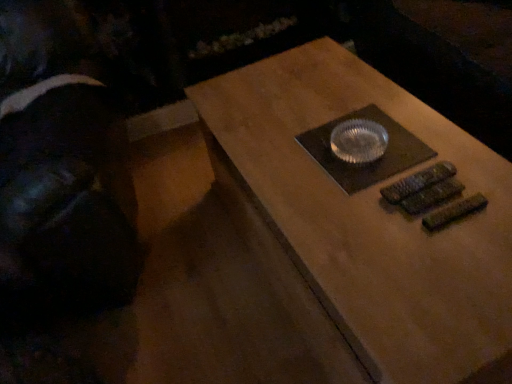
Question: From the image's perspective, is matte brown table at center located above or below black fabric at left?

Choices:
 (A) above
 (B) below

Answer: (B)

Question: Based on their positions, is matte brown table at center located to the left or right of black fabric at left?

Choices:
 (A) right
 (B) left

Answer: (A)

Question: From a real-world perspective, is matte brown table at center above or below black fabric at left?

Choices:
 (A) above
 (B) below

Answer: (B)

Question: From a real-world perspective, is black fabric at left positioned above or below matte brown table at center?

Choices:
 (A) below
 (B) above

Answer: (B)

Question: Does point (38, 221) appear closer or farther from the camera than point (266, 152)?

Choices:
 (A) closer
 (B) farther

Answer: (A)

Question: Is black fabric at left inside the boundaries of matte brown table at center, or outside?

Choices:
 (A) inside
 (B) outside

Answer: (B)

Question: Is black fabric at left bigger or smaller than matte brown table at center?

Choices:
 (A) small
 (B) big

Answer: (B)